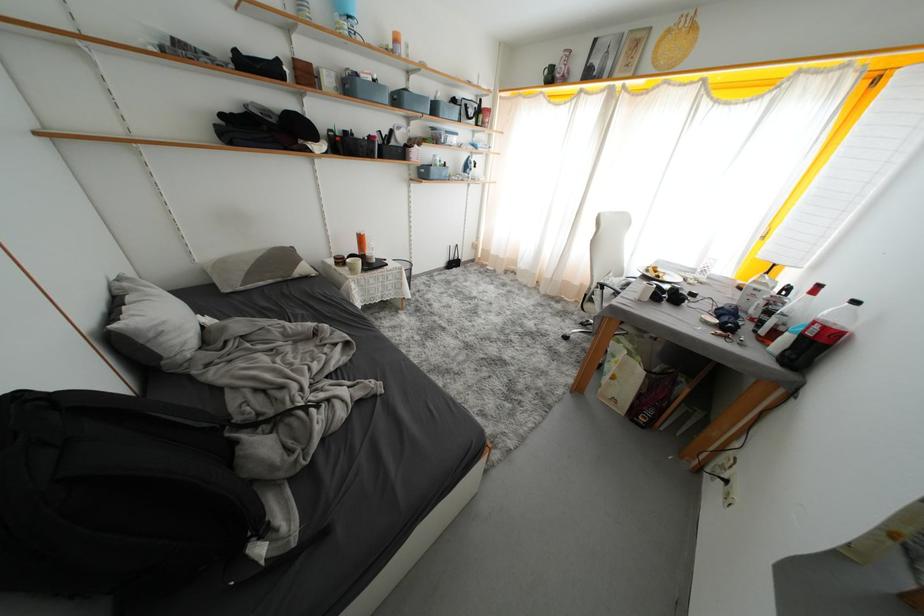
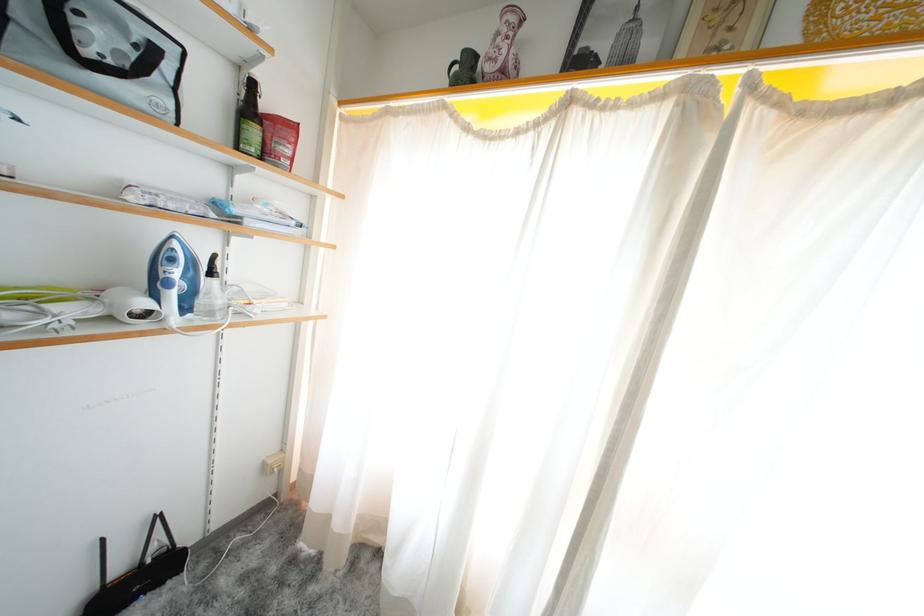
Locate, in the second image, the point that corresponds to point (489, 128) in the first image.

(273, 158)